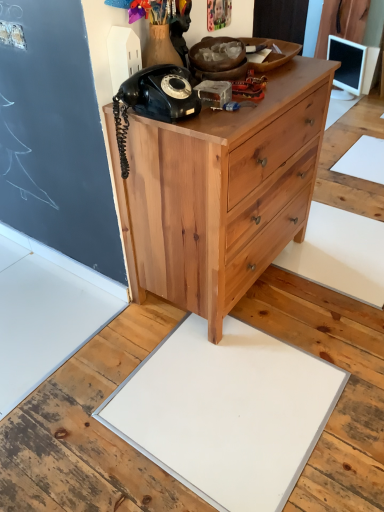
Question: Does point (193, 437) appear closer or farther from the camera than point (160, 140)?

Choices:
 (A) farther
 (B) closer

Answer: (A)

Question: From their relative heights in the image, would you say white matte slate at center is taller or shorter than natural wood chest of drawers at center?

Choices:
 (A) tall
 (B) short

Answer: (B)

Question: Based on their relative distances, which object is farther from the white matte slate at center?

Choices:
 (A) white glossy monitor at upper right
 (B) black matte rotary phone at upper left
 (C) natural wood chest of drawers at center

Answer: (A)

Question: Estimate the real-world distances between objects in this image. Which object is farther from the black matte rotary phone at upper left?

Choices:
 (A) natural wood chest of drawers at center
 (B) white glossy monitor at upper right
 (C) white matte slate at center

Answer: (B)